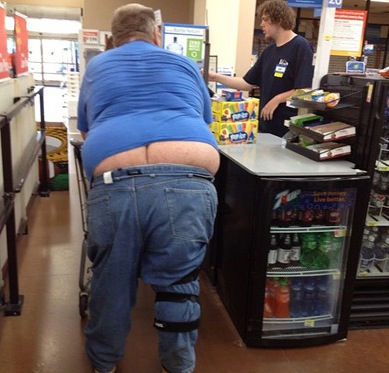
Identify the location of fridge. The height and width of the screenshot is (373, 389). (276, 214), (382, 113).